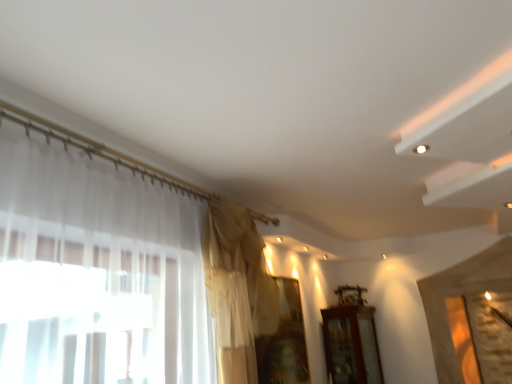
Question: Would you say silky beige curtain at upper center is outside transparent fabric at center?

Choices:
 (A) yes
 (B) no

Answer: (A)

Question: Could you tell me if silky beige curtain at upper center is turned towards transparent fabric at center?

Choices:
 (A) no
 (B) yes

Answer: (A)

Question: Is silky beige curtain at upper center at the right side of transparent fabric at center?

Choices:
 (A) no
 (B) yes

Answer: (A)

Question: Considering the relative positions of silky beige curtain at upper center and transparent fabric at center in the image provided, is silky beige curtain at upper center to the left of transparent fabric at center from the viewer's perspective?

Choices:
 (A) no
 (B) yes

Answer: (B)

Question: Does silky beige curtain at upper center come in front of transparent fabric at center?

Choices:
 (A) no
 (B) yes

Answer: (B)

Question: From a real-world perspective, is silky beige curtain at upper center above or below brown wooden cabinet at lower right?

Choices:
 (A) above
 (B) below

Answer: (A)

Question: From the image's perspective, is silky beige curtain at upper center located above or below brown wooden cabinet at lower right?

Choices:
 (A) below
 (B) above

Answer: (B)

Question: Looking at their shapes, would you say silky beige curtain at upper center is wider or thinner than brown wooden cabinet at lower right?

Choices:
 (A) thin
 (B) wide

Answer: (A)

Question: Is point (259, 274) positioned closer to the camera than point (325, 327)?

Choices:
 (A) farther
 (B) closer

Answer: (B)

Question: Is silky beige curtain at upper center taller or shorter than transparent fabric at center?

Choices:
 (A) short
 (B) tall

Answer: (B)

Question: Considering the positions of point (262, 301) and point (298, 324), is point (262, 301) closer or farther from the camera than point (298, 324)?

Choices:
 (A) farther
 (B) closer

Answer: (B)

Question: Is silky beige curtain at upper center inside or outside of transparent fabric at center?

Choices:
 (A) outside
 (B) inside

Answer: (A)

Question: Considering their positions, is silky beige curtain at upper center located in front of or behind transparent fabric at center?

Choices:
 (A) front
 (B) behind

Answer: (A)

Question: In terms of size, does transparent fabric at center appear bigger or smaller than silky beige curtain at upper center?

Choices:
 (A) big
 (B) small

Answer: (B)

Question: Looking at their shapes, would you say transparent fabric at center is wider or thinner than silky beige curtain at upper center?

Choices:
 (A) thin
 (B) wide

Answer: (A)